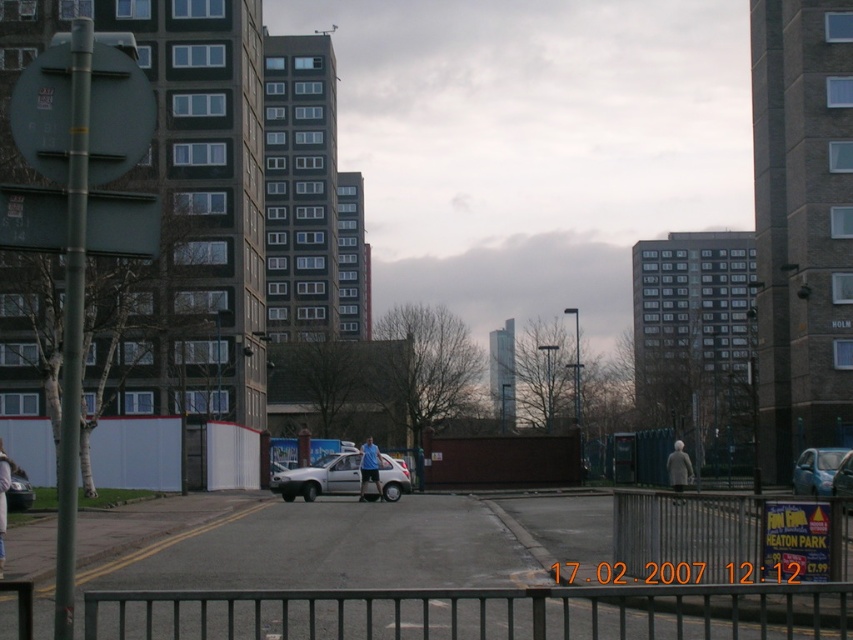
Who is lower down, black metal fence at lower center or silver metallic car at lower left?

silver metallic car at lower left

Between black metal fence at lower center and silver metallic car at lower left, which one appears on the right side from the viewer's perspective?

black metal fence at lower center is more to the right.

Is point (509, 628) behind point (21, 497)?

No, it is in front of (21, 497).

Locate an element on the screen. The image size is (853, 640). black metal fence at lower center is located at coordinates (479, 612).

Is metallic silver fence at lower center to the left of silver metallic car at lower left from the viewer's perspective?

Incorrect, metallic silver fence at lower center is not on the left side of silver metallic car at lower left.

Can you confirm if metallic silver fence at lower center is positioned to the right of silver metallic car at lower left?

Yes, metallic silver fence at lower center is to the right of silver metallic car at lower left.

Identify the location of metallic silver fence at lower center. (689, 529).

Does black metal fence at lower center have a lesser width compared to blue metallic car at right?

Yes.

Which is more to the left, black metal fence at lower center or blue metallic car at right?

black metal fence at lower center is more to the left.

Is point (207, 602) behind point (830, 464)?

No, (207, 602) is in front of (830, 464).

Find the location of a particular element. This screenshot has width=853, height=640. black metal fence at lower center is located at coordinates (479, 612).